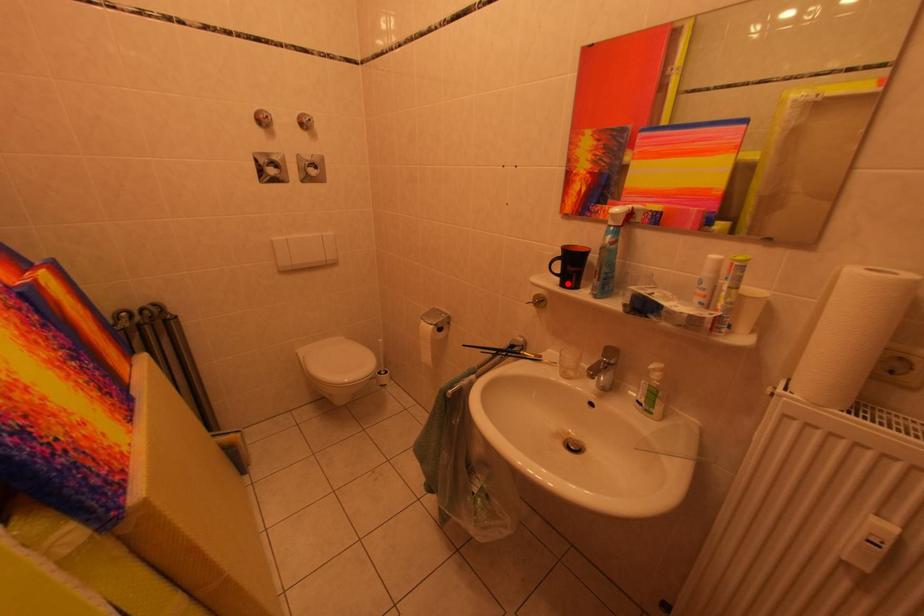
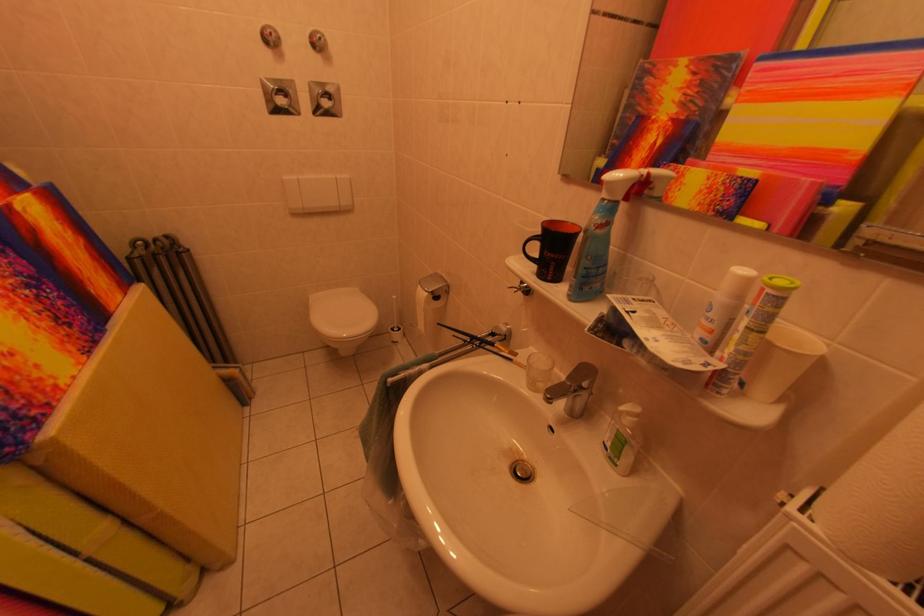
Question: I am providing you with two images of the same scene from different viewpoints. A red point is marked on the first image. Can you still see the location of the red point in image 2?

Choices:
 (A) Yes
 (B) No

Answer: (A)